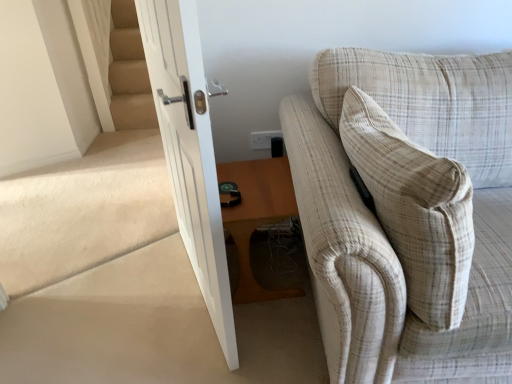
Identify the location of vacant space in front of beige carpeted stairs at left. (96, 317).